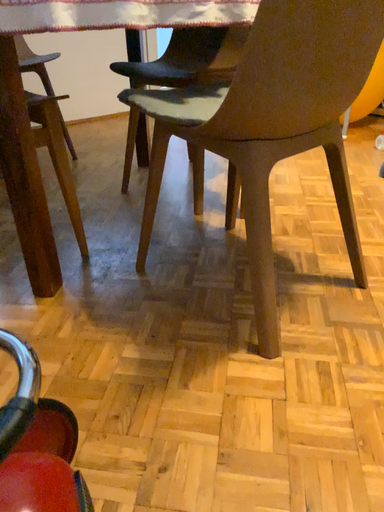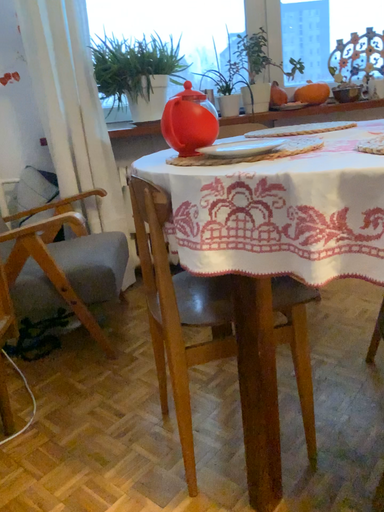
Question: Which way did the camera rotate in the video?

Choices:
 (A) rotated left
 (B) rotated right

Answer: (A)